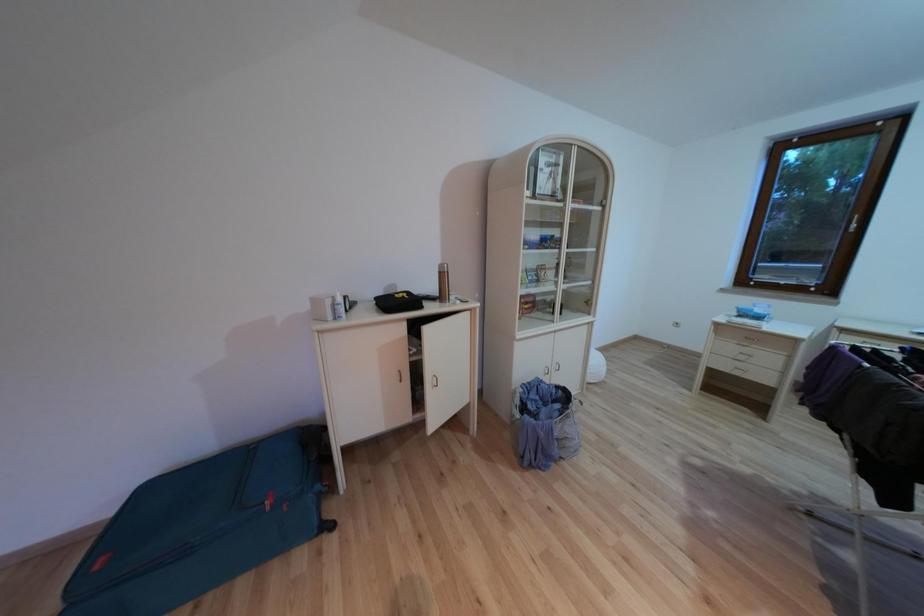
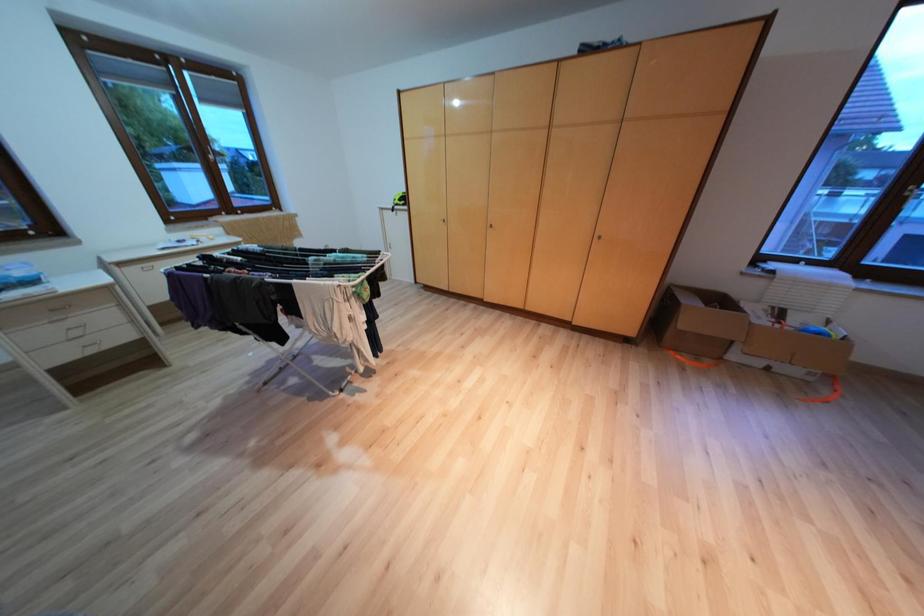
Consider the image. Based on the continuous images, in which direction is the camera rotating?

The camera's rotation is toward right-down.